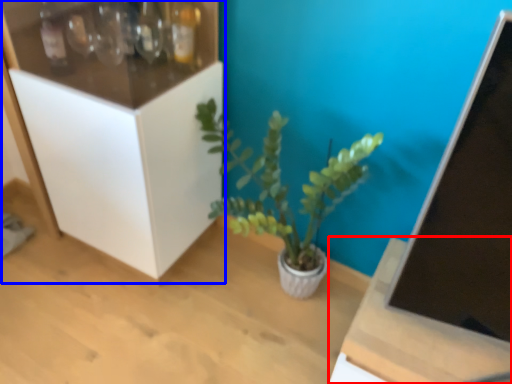
Question: Which point is further to the camera, table (highlighted by a red box) or cabinetry (highlighted by a blue box)?

Choices:
 (A) table
 (B) cabinetry

Answer: (B)